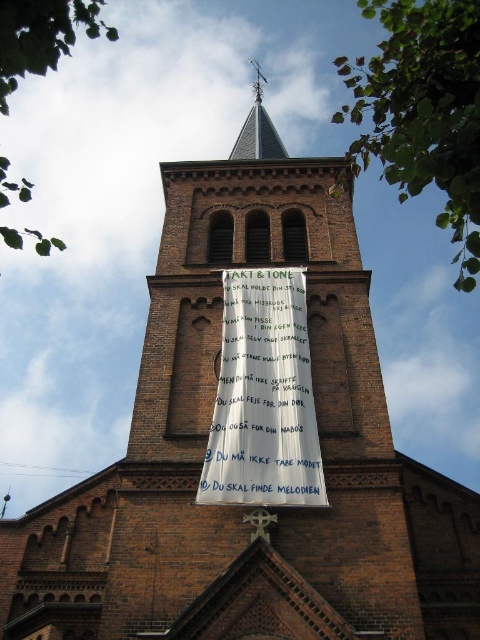
In the scene shown: You are a tourist standing at the base of the church tower. You want to read the text on the white paper banner at center but notice the smooth gray spire at upper center might be blocking your view. Is the banner visible to you?

The white paper banner at center is in front of the smooth gray spire at upper center, so the banner is not blocked by the spire and should be visible to you.

Based on the scene description, which object is taller between the white paper banner at center and the smooth gray spire at upper center?

The smooth gray spire at upper center is taller than the white paper banner at center.